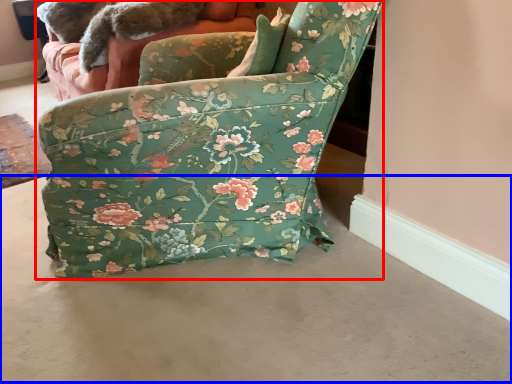
Question: Which of the following is the closest to the observer, chair (highlighted by a red box) or concrete (highlighted by a blue box)?

Choices:
 (A) chair
 (B) concrete

Answer: (B)